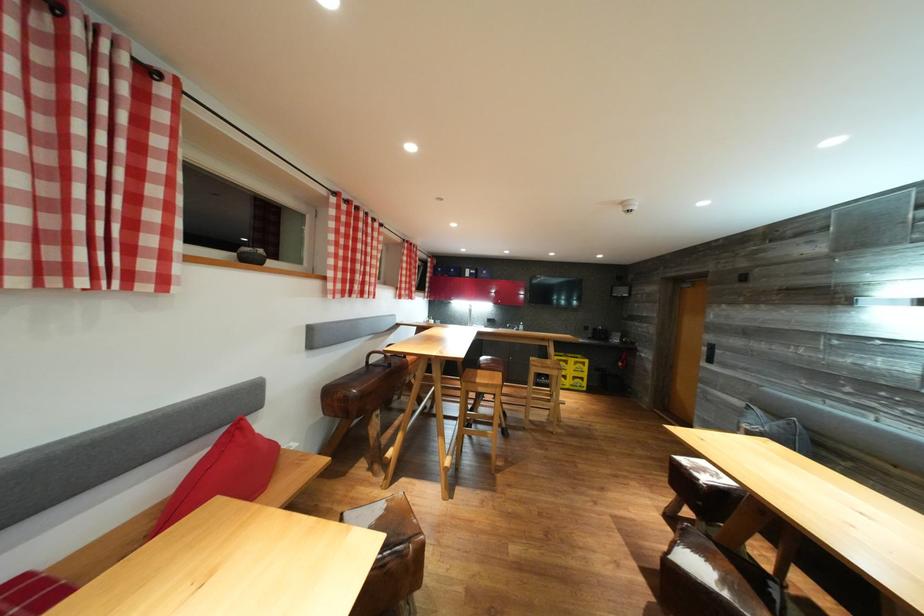
What do you see at coordinates (379, 360) in the screenshot? I see `the pommel horse handle` at bounding box center [379, 360].